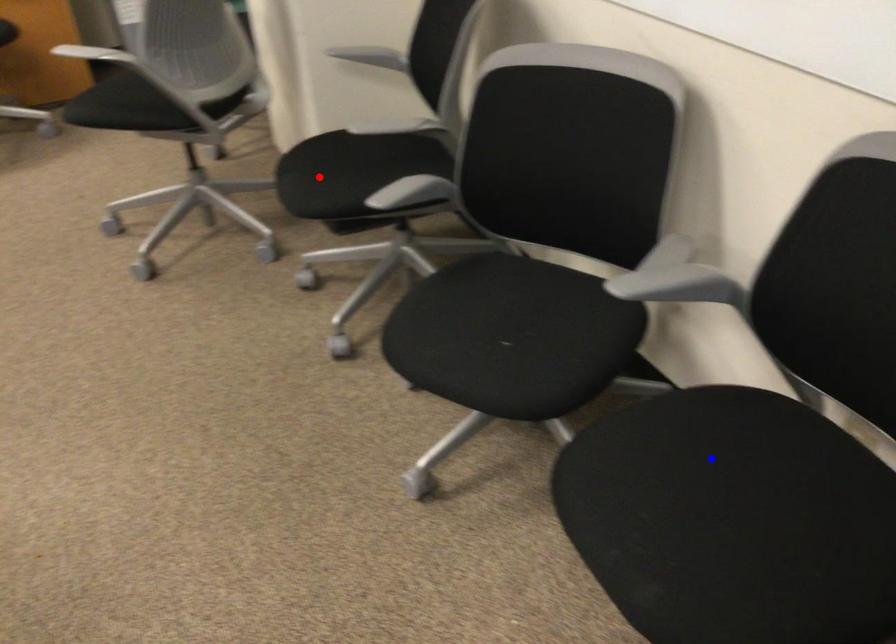
Question: Two points are marked on the image. Which point is closer to the camera?

Choices:
 (A) Blue point is closer.
 (B) Red point is closer.

Answer: (A)